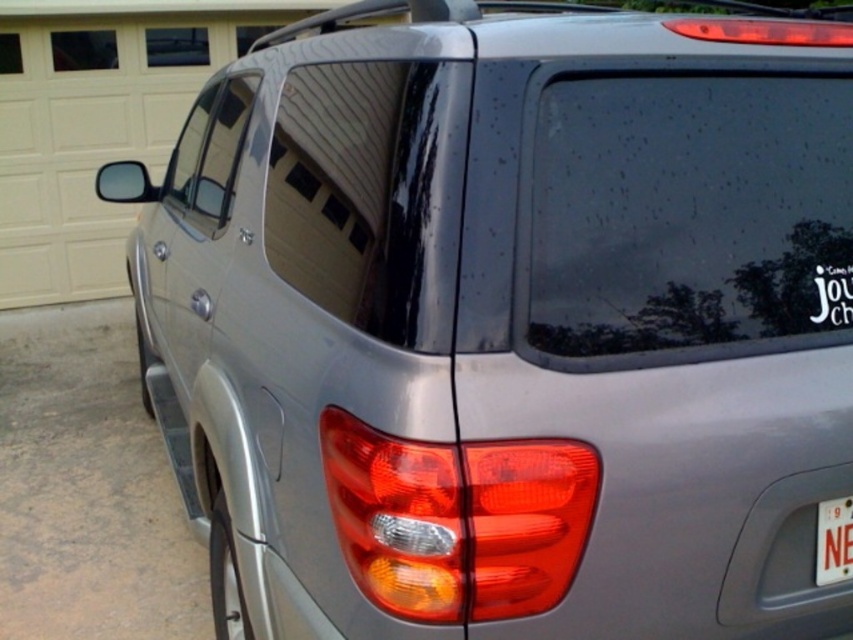
Question: Which object is farther from the camera taking this photo?

Choices:
 (A) white plastic license plate at lower right
 (B) matte plastic tail light at center

Answer: (A)

Question: Is matte plastic tail light at center smaller than white plastic license plate at lower right?

Choices:
 (A) yes
 (B) no

Answer: (B)

Question: Considering the relative positions of matte plastic tail light at center and white plastic license plate at lower right in the image provided, where is matte plastic tail light at center located with respect to white plastic license plate at lower right?

Choices:
 (A) right
 (B) left

Answer: (B)

Question: Can you confirm if matte plastic tail light at center is positioned to the right of white plastic license plate at lower right?

Choices:
 (A) no
 (B) yes

Answer: (A)

Question: Which object is closer to the camera taking this photo?

Choices:
 (A) matte plastic tail light at center
 (B) white plastic license plate at lower right

Answer: (A)